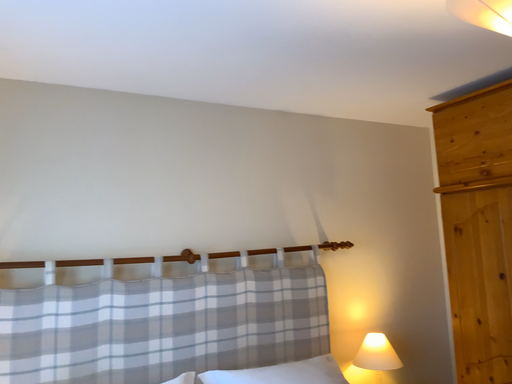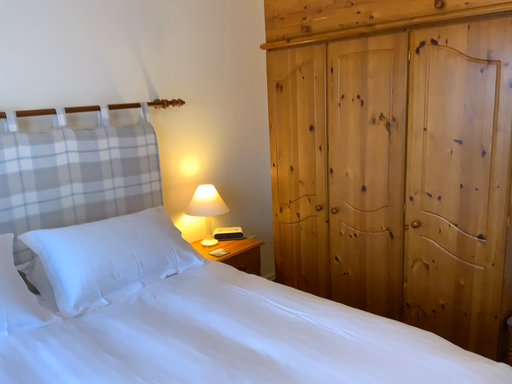
Question: How did the camera likely rotate when shooting the video?

Choices:
 (A) rotated left
 (B) rotated right

Answer: (B)